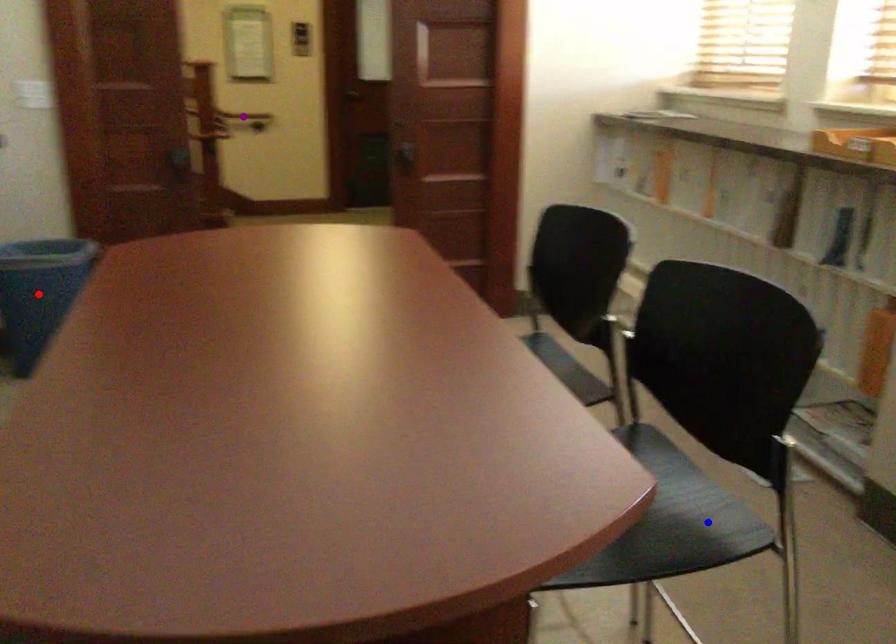
Order these from farthest to nearest:
- blue point
- purple point
- red point

purple point
red point
blue point